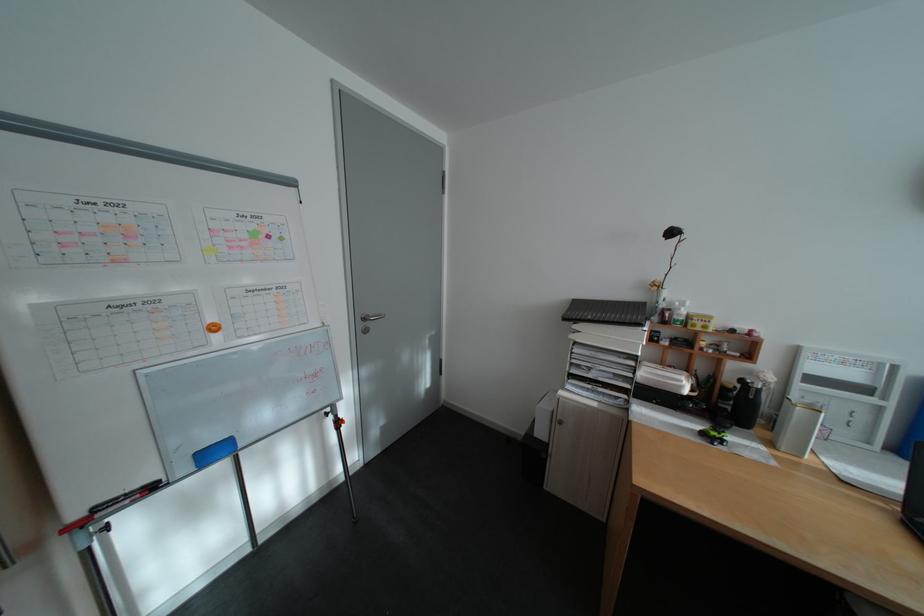
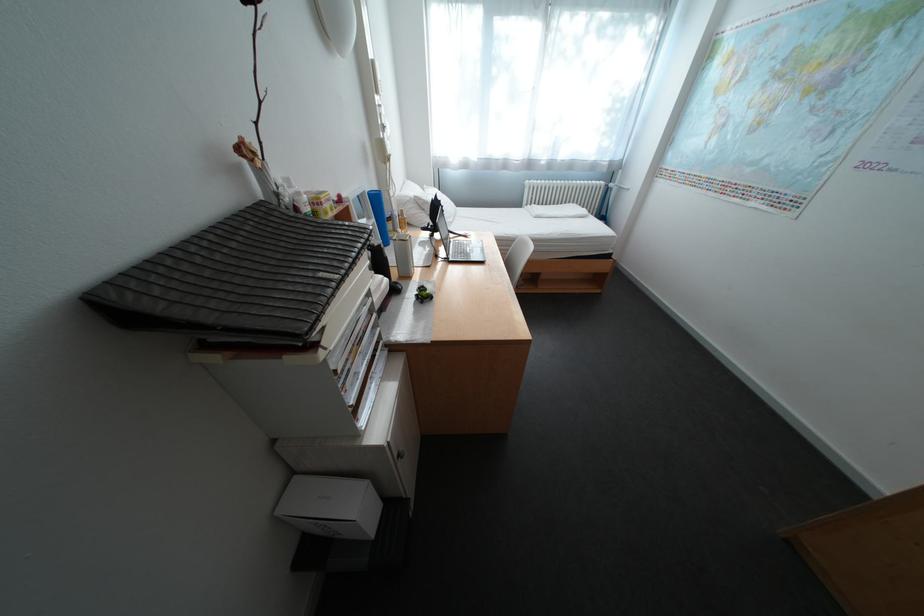
In the second image, find the point that corresponds to [678,384] in the first image.

(395, 292)